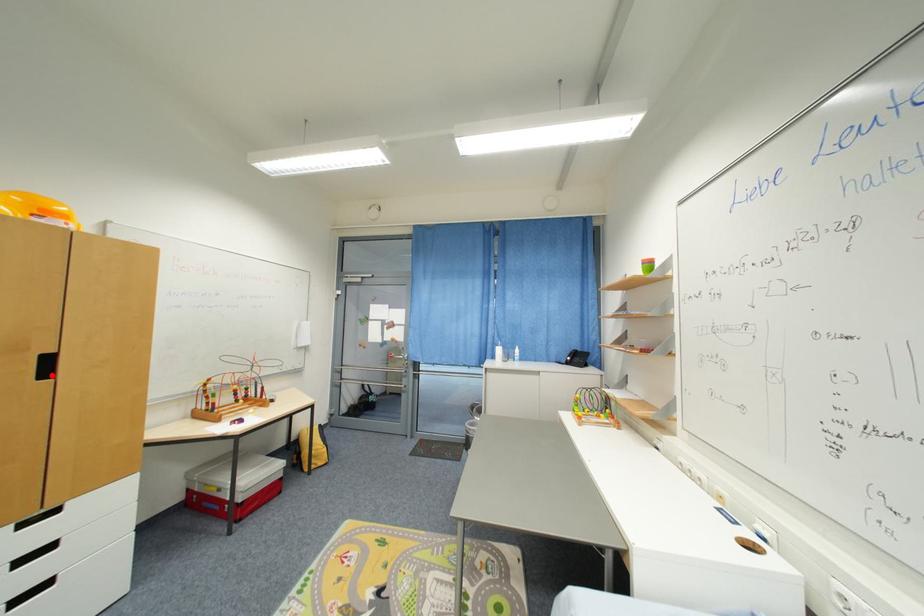
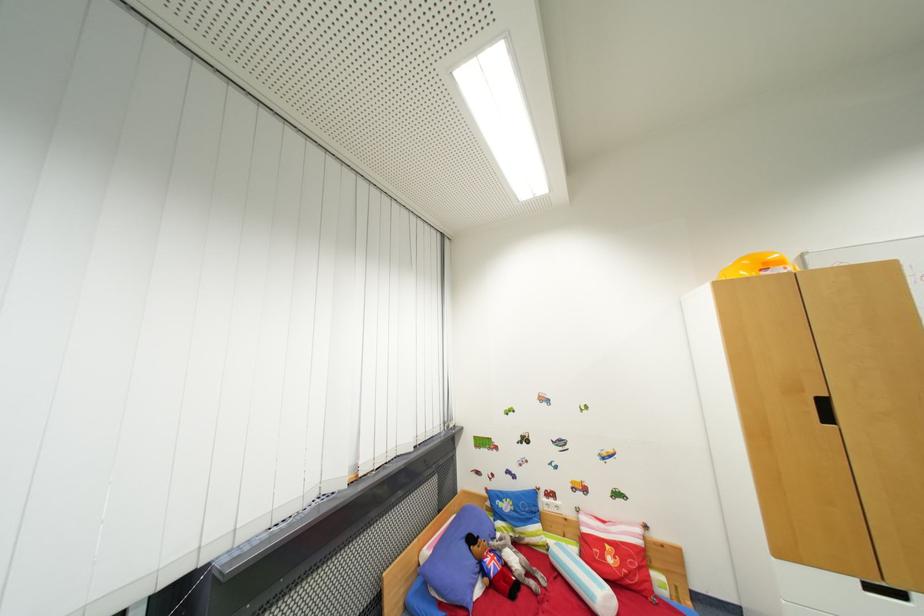
Question: I am providing you with two images of the same scene from different viewpoints. A red point is marked on the first image. Is the red point's position out of view in image 2?

Choices:
 (A) Yes
 (B) No

Answer: (B)